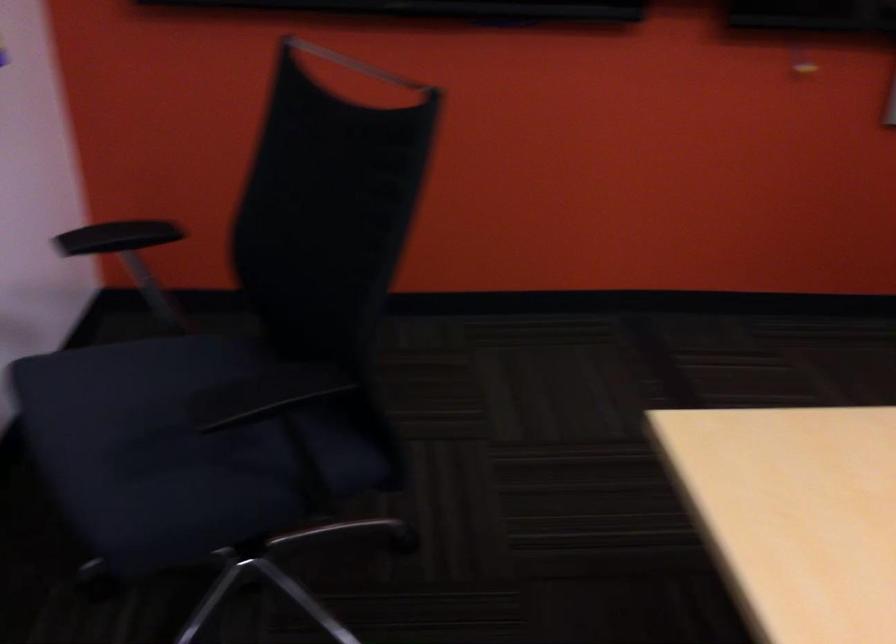
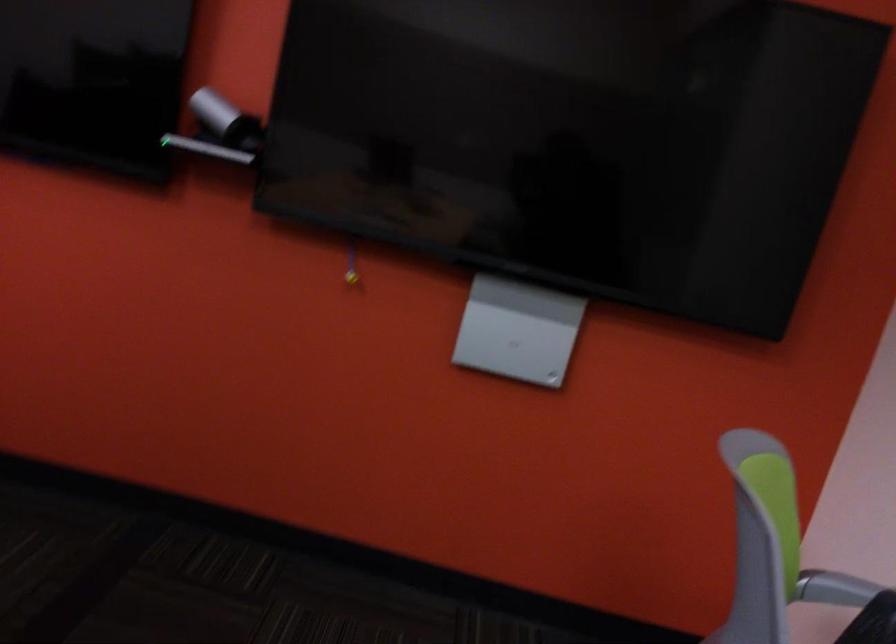
Question: In a continuous first-person perspective shot, in which direction is the camera moving?

Choices:
 (A) Left
 (B) Right
 (C) Forward
 (D) Backward

Answer: (B)